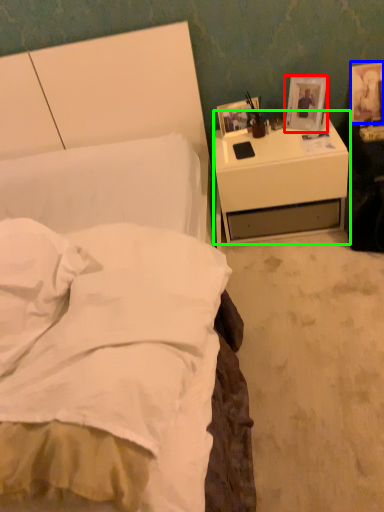
Question: Considering the real-world distances, which object is farthest from picture frame (highlighted by a red box)? picture frame (highlighted by a blue box) or nightstand (highlighted by a green box)?

Choices:
 (A) picture frame
 (B) nightstand

Answer: (A)